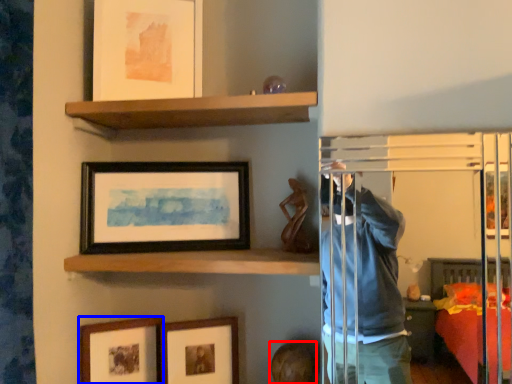
Question: Which object appears farthest to the camera in this image, head (highlighted by a red box) or picture frame (highlighted by a blue box)?

Choices:
 (A) head
 (B) picture frame

Answer: (B)